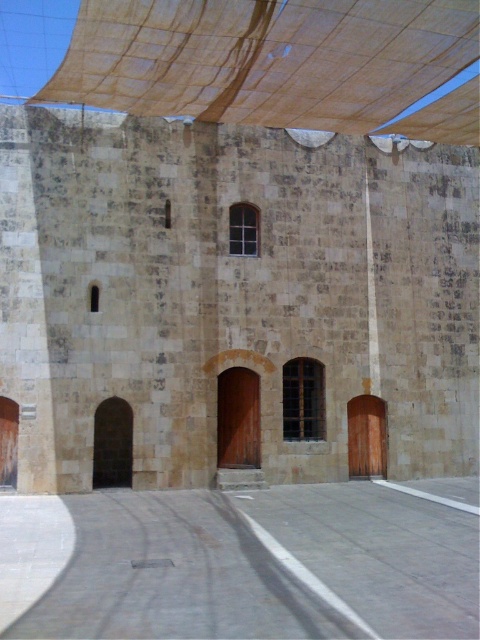
Question: Observing the image, what is the correct spatial positioning of brown stone building at center in reference to brown fabric canopy at upper center?

Choices:
 (A) right
 (B) left

Answer: (B)

Question: In this image, where is brown stone building at center located relative to brown fabric canopy at upper center?

Choices:
 (A) right
 (B) left

Answer: (B)

Question: Which object appears farthest from the camera in this image?

Choices:
 (A) brown fabric canopy at upper center
 (B) brown stone building at center

Answer: (B)

Question: Which point is farther to the camera?

Choices:
 (A) brown fabric canopy at upper center
 (B) brown stone building at center

Answer: (B)

Question: Where is brown stone building at center located in relation to brown fabric canopy at upper center in the image?

Choices:
 (A) left
 (B) right

Answer: (A)